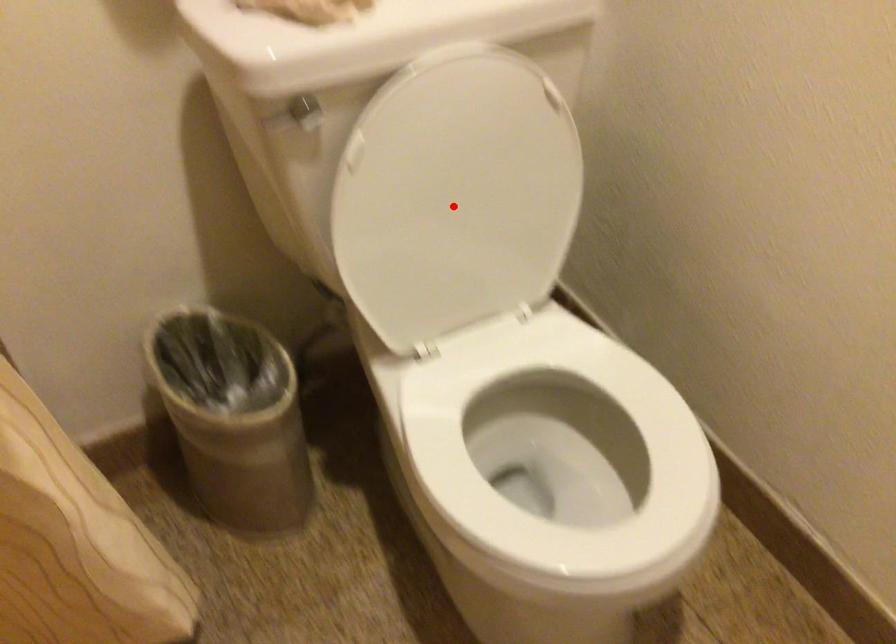
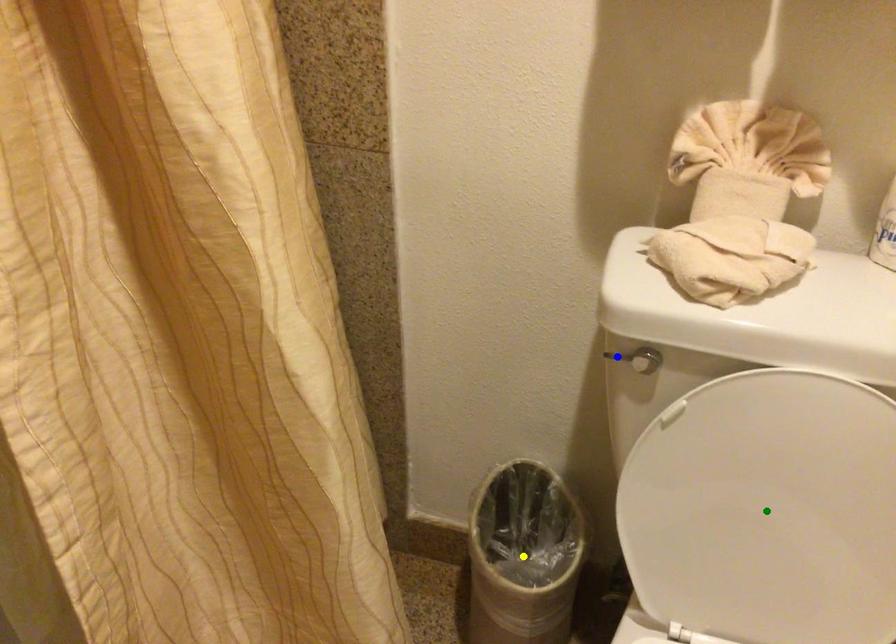
Question: I am providing you with two images of the same scene from different viewpoints. A red point is marked on the first image. You are given multiple points on the second image. Which point in image 2 is actually the same real-world point as the red point in image 1?

Choices:
 (A) blue point
 (B) yellow point
 (C) green point

Answer: (C)